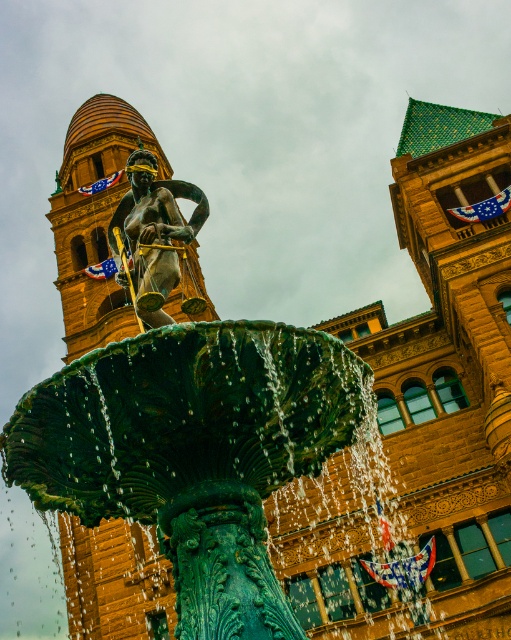
You are an architect analyzing the spatial arrangement of the fountain area. From your vantage point, does the golden stone bell tower at upper left appear higher or lower than the bronze statue at center?

The golden stone bell tower at upper left is located below the bronze statue at center, so it appears lower than the bronze statue at center from this vantage point.

Consider the image. You are a tourist standing in front of the fountain sculpture. You notice a specific point marked at coordinates (95, 220). Based on the scene description, can you identify what structure this point is located on?

The point at (95, 220) is located on the golden stone bell tower at upper left.

You are standing in front of the fountain sculpture and want to take a photo that includes both the golden stone bell tower at upper left and the central fountain figure. Given that the bell tower is positioned at coordinates approximately 0.344 on the x and 0.186 on the y, where should you position yourself relative to the fountain to ensure both elements are in frame?

To capture both the golden stone bell tower at upper left and the central fountain figure in your photo, you should position yourself to the lower right of the fountain. This placement will allow the bell tower at coordinates [95,220] to be included in the upper left of the frame while keeping the central fountain figure centered or slightly to the right.